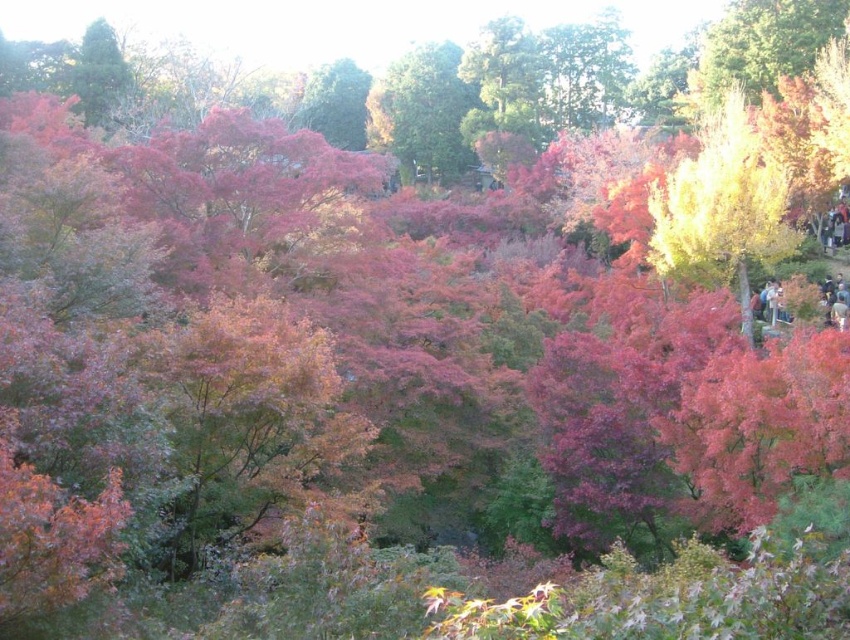
Can you confirm if yellow-green leafy tree at right is positioned to the left of green matte tree at center?

Incorrect, yellow-green leafy tree at right is not on the left side of green matte tree at center.

Between yellow-green leafy tree at right and green matte tree at center, which one is positioned higher?

green matte tree at center is above.

Measure the distance between point (717, 248) and camera.

A distance of 46.25 meters exists between point (717, 248) and camera.

Locate an element on the screen. The height and width of the screenshot is (640, 850). yellow-green leafy tree at right is located at coordinates (722, 205).